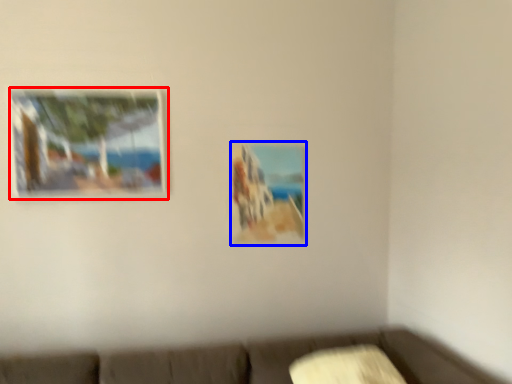
Question: Which object appears farthest to the camera in this image, picture frame (highlighted by a red box) or picture frame (highlighted by a blue box)?

Choices:
 (A) picture frame
 (B) picture frame

Answer: (B)